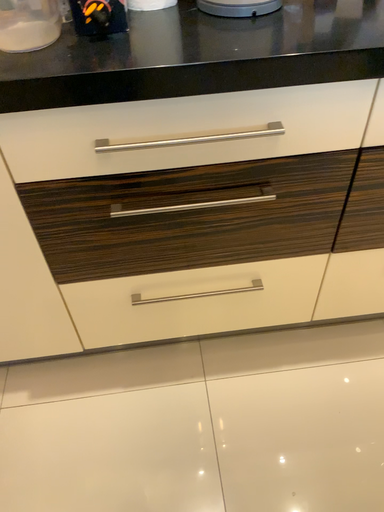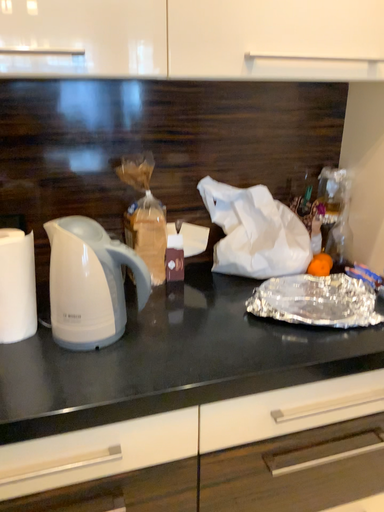
Question: Which way did the camera rotate in the video?

Choices:
 (A) rotated downward
 (B) rotated upward

Answer: (B)